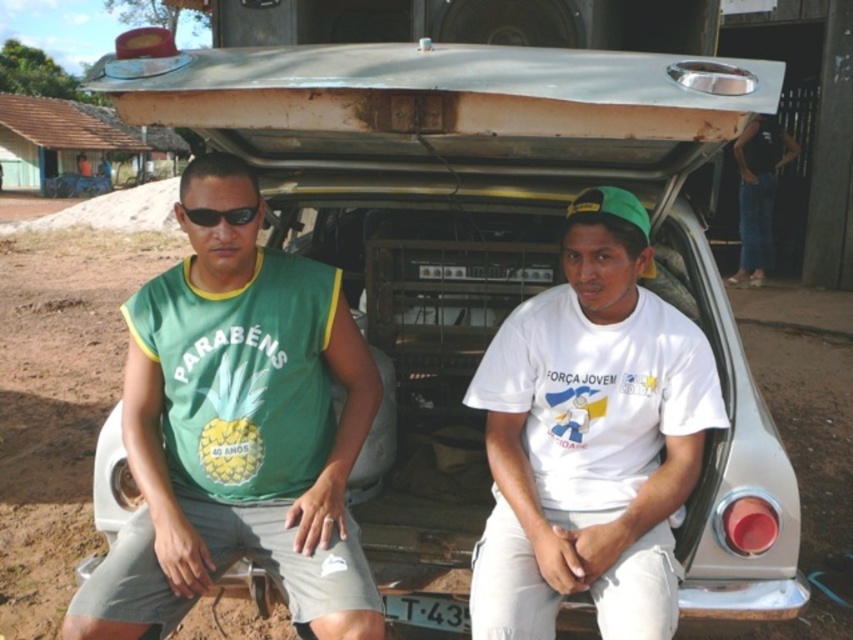
Is point (601, 240) positioned in front of point (767, 118)?

That is True.

Does white matte t-shirt at center have a lesser height compared to jeans at right?

Yes, white matte t-shirt at center is shorter than jeans at right.

Based on the photo, who is more distant from viewer, [553,413] or [762,275]?

The point [762,275] is more distant.

This screenshot has height=640, width=853. Find the location of `white matte t-shirt at center`. white matte t-shirt at center is located at coordinates (590, 436).

Measure the distance between jeans at right and camera.

jeans at right and camera are 9.65 meters apart from each other.

I want to click on jeans at right, so click(x=758, y=193).

Is point (763, 157) closer to camera compared to point (206, 216)?

No, (763, 157) is further to viewer.

Locate an element on the screen. Image resolution: width=853 pixels, height=640 pixels. jeans at right is located at coordinates (758, 193).

Which is behind, point (160, 589) or point (659, 464)?

Point (659, 464)

Is green fabric shirt at center above white matte t-shirt at center?

Indeed, green fabric shirt at center is positioned over white matte t-shirt at center.

Find the location of `green fabric shirt at center`. green fabric shirt at center is located at coordinates (236, 432).